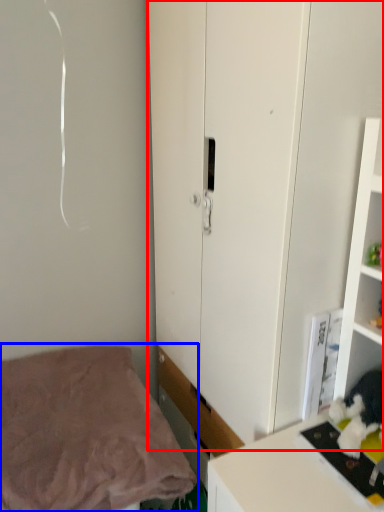
Question: Which object is further to the camera taking this photo, cupboard (highlighted by a red box) or bed (highlighted by a blue box)?

Choices:
 (A) cupboard
 (B) bed

Answer: (B)